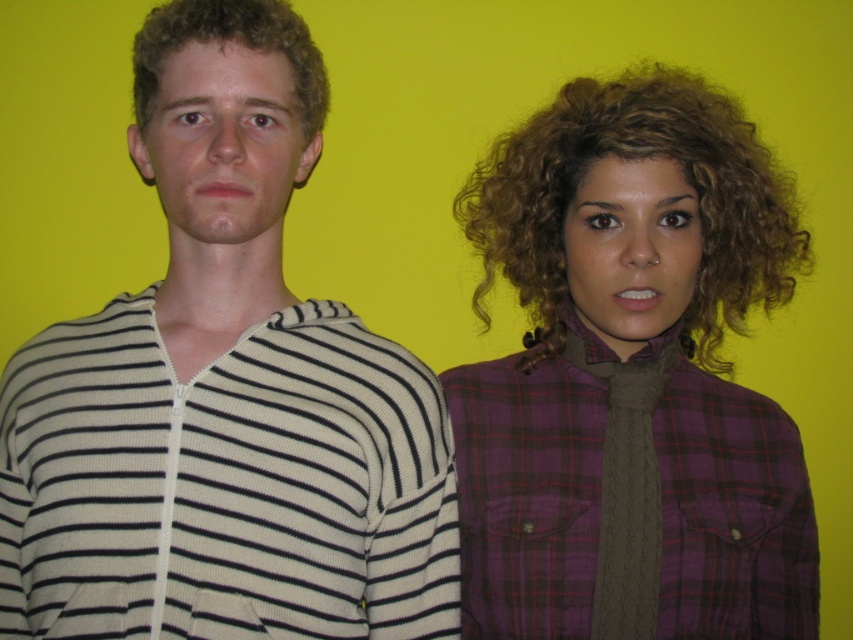
Is white striped sweater at left smaller than purple plaid shirt at right?

Indeed, white striped sweater at left has a smaller size compared to purple plaid shirt at right.

Is white striped sweater at left below purple plaid shirt at right?

Incorrect, white striped sweater at left is not positioned below purple plaid shirt at right.

Find the location of a particular element. The width and height of the screenshot is (853, 640). white striped sweater at left is located at coordinates (224, 394).

Where is `white striped sweater at left`? white striped sweater at left is located at coordinates (224, 394).

You are a GUI agent. You are given a task and a screenshot of the screen. Output one action in this format:
    pyautogui.click(x=<x>, y=<y>)
    Task: Click on the white striped sweater at left
    
    Given the screenshot: What is the action you would take?
    pyautogui.click(x=224, y=394)

Does white striped sweater at left have a greater height compared to curly blonde hair at left?

Indeed, white striped sweater at left has a greater height compared to curly blonde hair at left.

Describe the element at coordinates (224, 394) in the screenshot. I see `white striped sweater at left` at that location.

Find the location of a particular element. Image resolution: width=853 pixels, height=640 pixels. white striped sweater at left is located at coordinates (224, 394).

Is purple plaid shirt at right above curly blonde hair at left?

Incorrect, purple plaid shirt at right is not positioned above curly blonde hair at left.

Locate an element on the screen. The height and width of the screenshot is (640, 853). purple plaid shirt at right is located at coordinates (631, 378).

The height and width of the screenshot is (640, 853). Identify the location of purple plaid shirt at right. (631, 378).